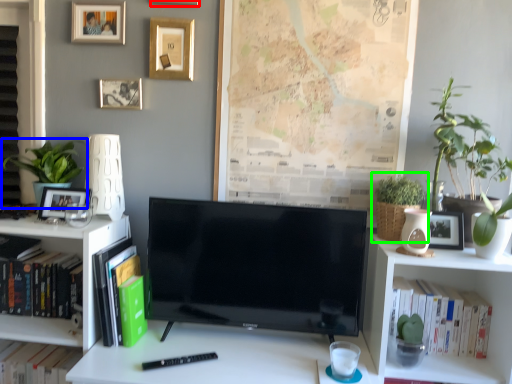
Question: Considering the real-world distances, which object is closest to picture frame (highlighted by a red box)? houseplant (highlighted by a blue box) or houseplant (highlighted by a green box).

Choices:
 (A) houseplant
 (B) houseplant

Answer: (A)